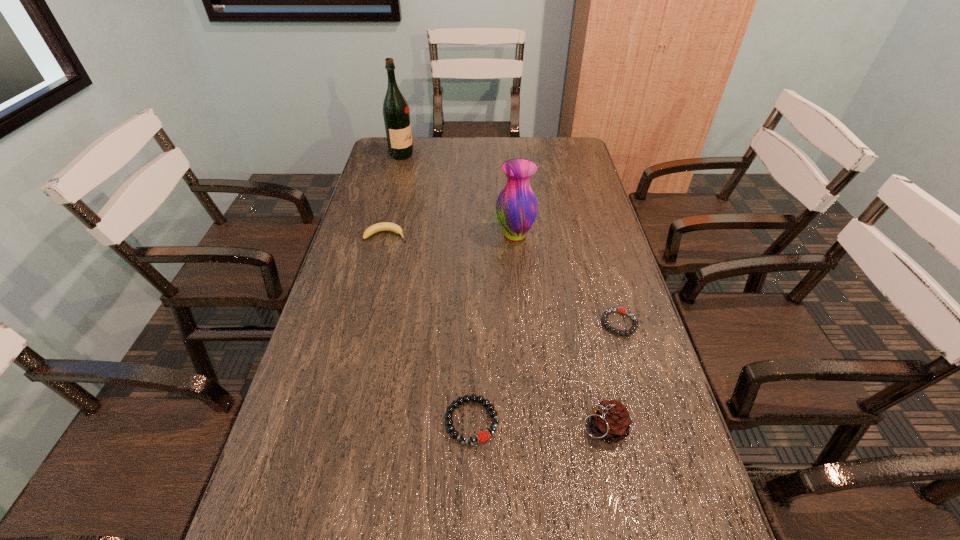
Where is `empty location between the third nearest object and the banana`? The image size is (960, 540). empty location between the third nearest object and the banana is located at coordinates tap(503, 279).

I want to click on free space that is in between the third object from right to left and the tallest object, so click(458, 195).

Find the location of a particular element. This screenshot has height=540, width=960. blank region between the second tallest object and the liquor is located at coordinates (458, 195).

Locate an element on the screen. The height and width of the screenshot is (540, 960). free area in between the rightmost object and the pinecone is located at coordinates (612, 375).

Where is `unoccupied area between the pinecone and the farther bracelet`? unoccupied area between the pinecone and the farther bracelet is located at coordinates (612, 375).

The height and width of the screenshot is (540, 960). Identify the location of free spot between the tallest object and the banana. (394, 195).

You are a GUI agent. You are given a task and a screenshot of the screen. Output one action in this format:
    pyautogui.click(x=<x>, y=<y>)
    Task: Click on the vacant region between the second tallest object and the fourth shortest object
    This screenshot has width=960, height=540.
    Given the screenshot: What is the action you would take?
    pyautogui.click(x=559, y=332)

In order to click on free spot between the rightmost object and the second shortest object in this screenshot , I will do `click(546, 372)`.

The width and height of the screenshot is (960, 540). Identify the location of vacant area between the fourth tallest object and the vase. (450, 235).

Locate an element on the screen. Image resolution: width=960 pixels, height=540 pixels. vacant space in between the right bracelet and the vase is located at coordinates (567, 279).